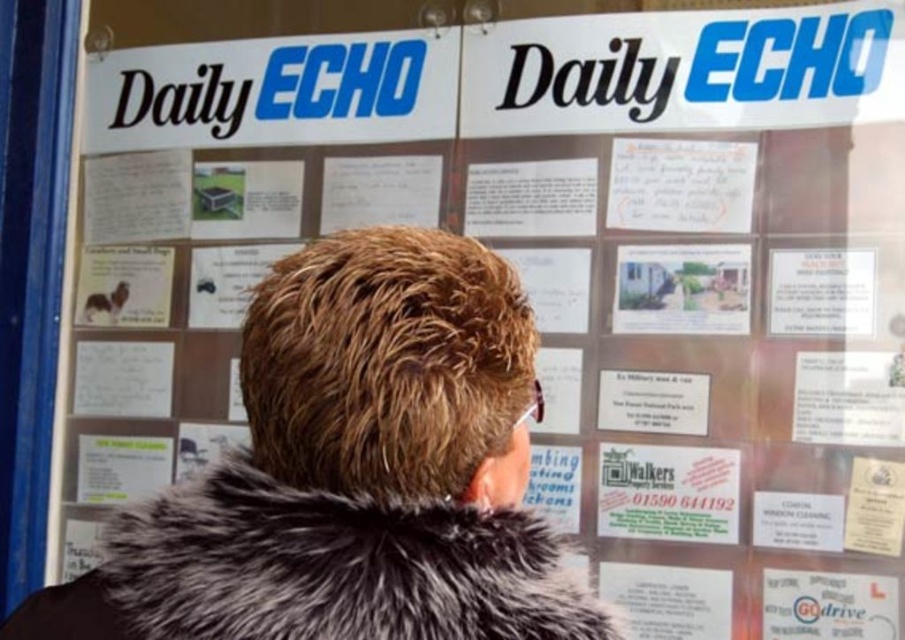
Question: In this image, where is brown fur coat at center located relative to fuzzy gray fur coat at center?

Choices:
 (A) right
 (B) left

Answer: (B)

Question: Is brown fur coat at center to the right of fuzzy gray fur coat at center from the viewer's perspective?

Choices:
 (A) no
 (B) yes

Answer: (A)

Question: Considering the relative positions of brown fur coat at center and fuzzy gray fur coat at center in the image provided, where is brown fur coat at center located with respect to fuzzy gray fur coat at center?

Choices:
 (A) above
 (B) below

Answer: (B)

Question: Which object is farther from the camera taking this photo?

Choices:
 (A) fuzzy gray fur coat at center
 (B) brown fur coat at center

Answer: (A)